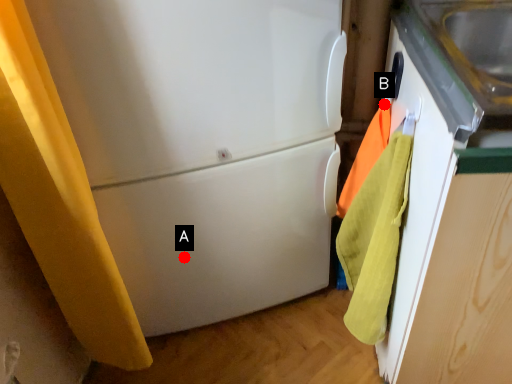
Question: Two points are circled on the image, labeled by A and B beside each circle. Which of the following is the farthest from the observer?

Choices:
 (A) A is further
 (B) B is further

Answer: (A)